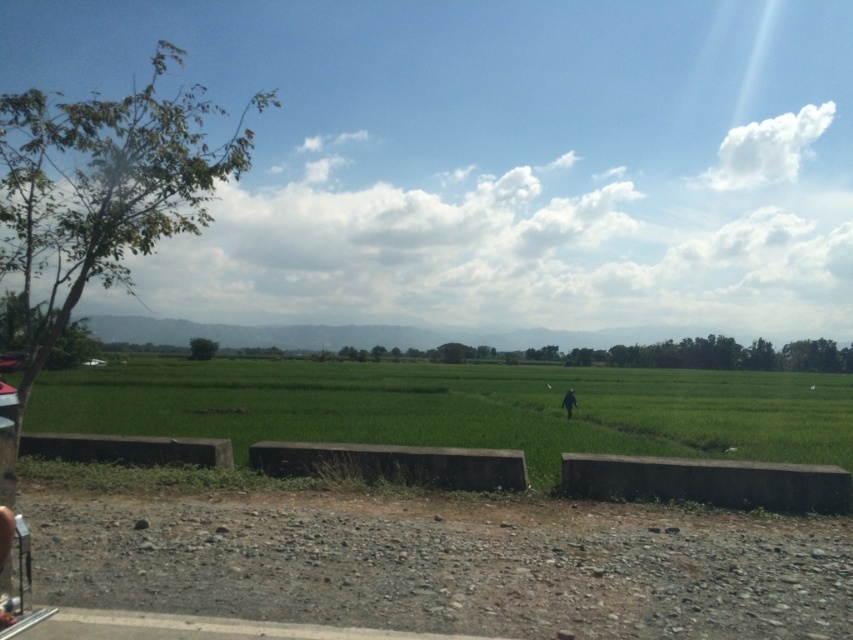
You are standing on the gravel road and want to walk to the green grass field at center and dark green grass at center. Which one will you reach first?

You will reach the green grass field at center first because it is closer to you than the dark green grass at center.

You are standing on the gravel road and looking towards the fields. Which of the two grass areas, the green grass field at center or the dark green grass at center, is closer to you?

The green grass field at center is closer to you because it is located below the dark green grass at center, meaning it is positioned lower in the image and thus nearer to the viewer.